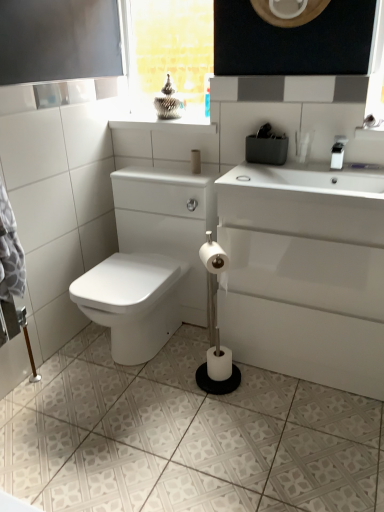
Question: Can you confirm if clear glass window at upper center is wider than matte beige toilet paper at center, marked as the 1th toilet paper in a back-to-front arrangement?

Choices:
 (A) no
 (B) yes

Answer: (A)

Question: Is clear glass window at upper center bigger than matte beige toilet paper at center, marked as the 1th toilet paper in a back-to-front arrangement?

Choices:
 (A) yes
 (B) no

Answer: (A)

Question: Considering the relative sizes of clear glass window at upper center and matte beige toilet paper at center, marked as the 1th toilet paper in a back-to-front arrangement, in the image provided, is clear glass window at upper center shorter than matte beige toilet paper at center, marked as the 1th toilet paper in a back-to-front arrangement,?

Choices:
 (A) yes
 (B) no

Answer: (B)

Question: Is clear glass window at upper center touching matte beige toilet paper at center, acting as the 3th toilet paper starting from the front?

Choices:
 (A) no
 (B) yes

Answer: (A)

Question: From the image's perspective, is clear glass window at upper center beneath matte beige toilet paper at center, acting as the 3th toilet paper starting from the front?

Choices:
 (A) no
 (B) yes

Answer: (A)

Question: From a real-world perspective, is white matte soap at upper right physically located above or below white glossy porcelain at lower right?

Choices:
 (A) above
 (B) below

Answer: (A)

Question: Is point (248, 177) positioned closer to the camera than point (342, 233)?

Choices:
 (A) closer
 (B) farther

Answer: (B)

Question: Which is correct: white matte soap at upper right is inside white glossy porcelain at lower right, or outside of it?

Choices:
 (A) outside
 (B) inside

Answer: (B)

Question: In terms of height, does white matte soap at upper right look taller or shorter compared to white glossy porcelain at lower right?

Choices:
 (A) short
 (B) tall

Answer: (A)

Question: From the image's perspective, relative to matte beige toilet paper at center, acting as the 3th toilet paper starting from the front, is clear glass window at upper center above or below?

Choices:
 (A) below
 (B) above

Answer: (B)

Question: Considering the positions of clear glass window at upper center and matte beige toilet paper at center, marked as the 1th toilet paper in a back-to-front arrangement, in the image, is clear glass window at upper center wider or thinner than matte beige toilet paper at center, marked as the 1th toilet paper in a back-to-front arrangement,?

Choices:
 (A) thin
 (B) wide

Answer: (A)

Question: Is clear glass window at upper center taller or shorter than matte beige toilet paper at center, acting as the 3th toilet paper starting from the front?

Choices:
 (A) tall
 (B) short

Answer: (A)

Question: Is clear glass window at upper center inside or outside of matte beige toilet paper at center, acting as the 3th toilet paper starting from the front?

Choices:
 (A) inside
 (B) outside

Answer: (B)

Question: Choose the correct answer: Is white matte toilet paper at center, the second toilet paper when ordered from front to back, inside white matte soap at upper right or outside it?

Choices:
 (A) inside
 (B) outside

Answer: (B)

Question: Looking at the image, does white matte toilet paper at center, the 1th toilet paper in the bottom-to-top sequence, seem bigger or smaller compared to white matte soap at upper right?

Choices:
 (A) small
 (B) big

Answer: (B)